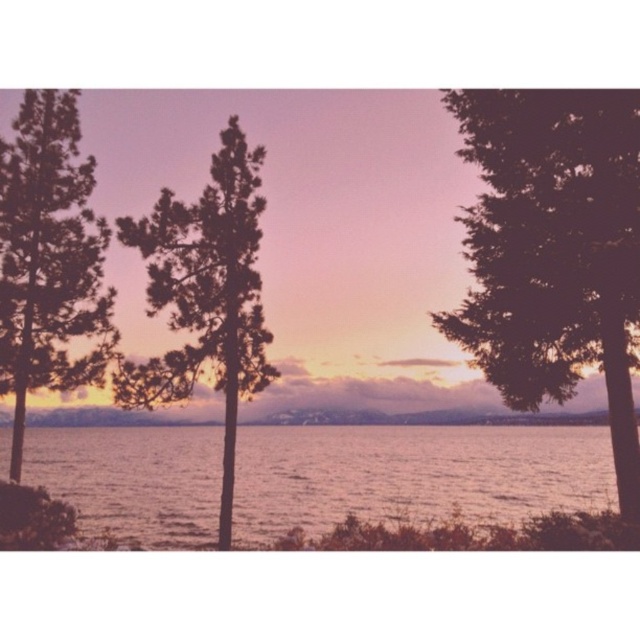
Does dark green textured tree at right appear over smooth water at center?

Yes, dark green textured tree at right is above smooth water at center.

Does dark green textured tree at right have a lesser width compared to smooth water at center?

Yes, dark green textured tree at right is thinner than smooth water at center.

Who is more forward, (620, 321) or (273, 499)?

Point (620, 321) is in front.

This screenshot has height=640, width=640. Find the location of `dark green textured tree at right`. dark green textured tree at right is located at coordinates click(x=554, y=250).

The width and height of the screenshot is (640, 640). Describe the element at coordinates (49, 259) in the screenshot. I see `green textured tree at left` at that location.

Which is below, green textured tree at left or green matte tree at center?

Positioned lower is green matte tree at center.

I want to click on green textured tree at left, so click(x=49, y=259).

Does dark green textured tree at right appear over green textured tree at left?

Yes, dark green textured tree at right is above green textured tree at left.

Which is behind, point (560, 195) or point (58, 266)?

Positioned behind is point (58, 266).

Identify the location of dark green textured tree at right. (554, 250).

The image size is (640, 640). In order to click on dark green textured tree at right in this screenshot , I will do `click(554, 250)`.